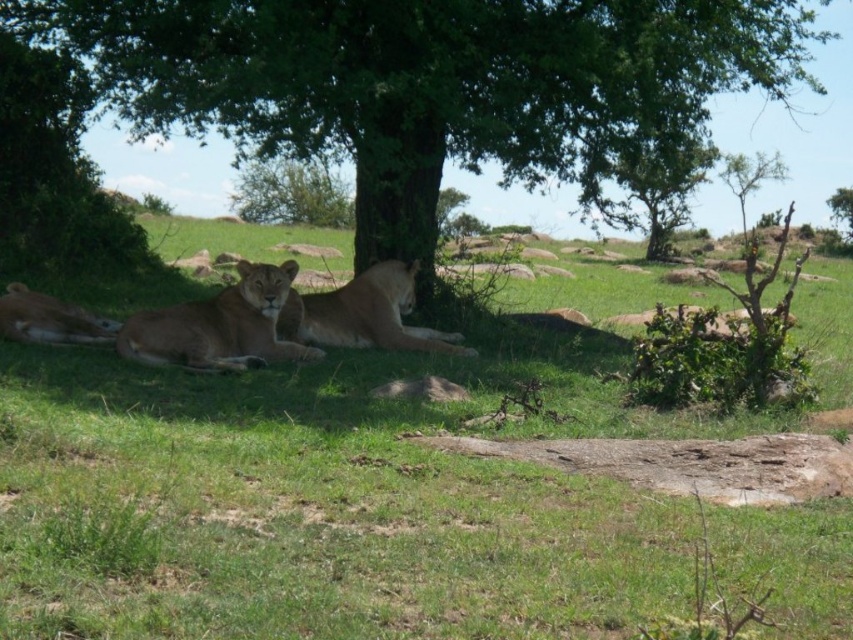
The width and height of the screenshot is (853, 640). Describe the element at coordinates (364, 314) in the screenshot. I see `brown fur lion at center` at that location.

Is brown fur lion at center closer to the viewer compared to brown fur lion at lower left?

No, it is behind brown fur lion at lower left.

Is point (341, 342) more distant than point (97, 320)?

Yes, point (341, 342) is farther from viewer.

At what (x,y) coordinates should I click in order to perform the action: click on brown fur lion at center. Please return your answer as a coordinate pair (x, y). Looking at the image, I should click on tap(364, 314).

Is green leafy tree at center further to the viewer compared to golden fur lion at center?

Yes, green leafy tree at center is behind golden fur lion at center.

Which of these two, green leafy tree at center or golden fur lion at center, stands shorter?

golden fur lion at center is shorter.

At what (x,y) coordinates should I click in order to perform the action: click on green leafy tree at center. Please return your answer as a coordinate pair (x, y). Image resolution: width=853 pixels, height=640 pixels. Looking at the image, I should click on (439, 86).

Is golden fur lion at center to the left of brown fur lion at lower left from the viewer's perspective?

Incorrect, golden fur lion at center is not on the left side of brown fur lion at lower left.

Is golden fur lion at center taller than brown fur lion at lower left?

Correct, golden fur lion at center is much taller as brown fur lion at lower left.

Who is more forward, (131, 333) or (27, 289)?

Point (131, 333) is in front.

The image size is (853, 640). Find the location of `golden fur lion at center`. golden fur lion at center is located at coordinates (219, 324).